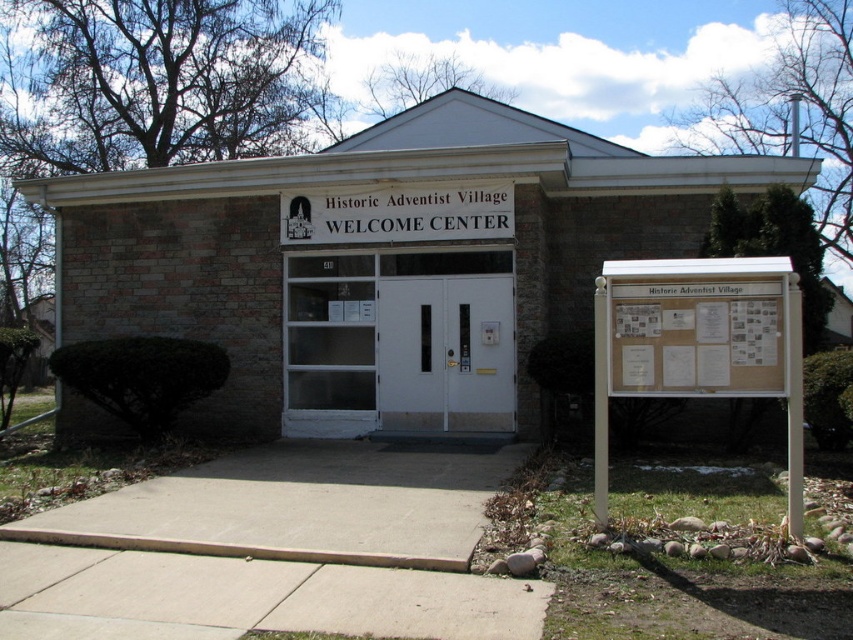
Measure the distance between white wood signboard at right and white wood sign at center.

A distance of 5.49 meters exists between white wood signboard at right and white wood sign at center.

Is point (718, 310) more distant than point (367, 225)?

No, it is in front of (367, 225).

At what (x,y) coordinates should I click in order to perform the action: click on white wood signboard at right. Please return your answer as a coordinate pair (x, y). Looking at the image, I should click on (699, 344).